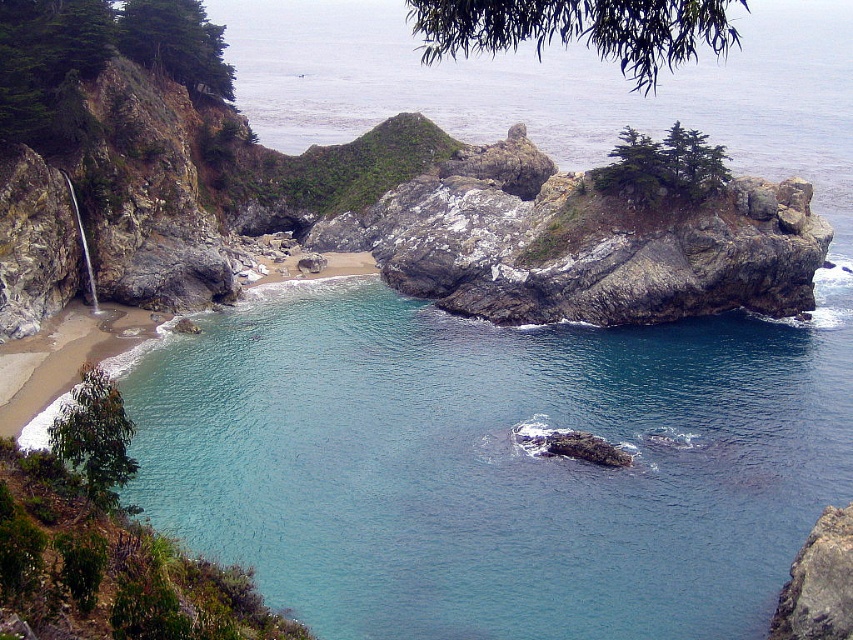
Question: Does clear blue water at center come in front of rocky cliff at lower right?

Choices:
 (A) yes
 (B) no

Answer: (B)

Question: Is clear blue water at center thinner than rocky cliff at lower right?

Choices:
 (A) yes
 (B) no

Answer: (B)

Question: Is clear blue water at center above rocky cliff at lower right?

Choices:
 (A) no
 (B) yes

Answer: (B)

Question: Which of the following is the closest to the observer?

Choices:
 (A) rocky cliff at lower right
 (B) clear blue water at center

Answer: (A)

Question: Among these points, which one is nearest to the camera?

Choices:
 (A) (787, 595)
 (B) (572, 612)

Answer: (B)